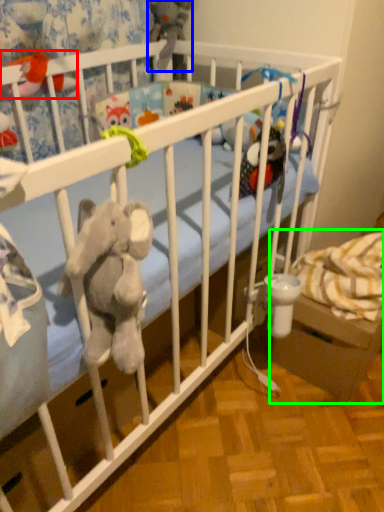
Question: Which object is positioned closest to toy (highlighted by a red box)? Select from toy (highlighted by a blue box) and baby carriage (highlighted by a green box).

Choices:
 (A) toy
 (B) baby carriage

Answer: (A)